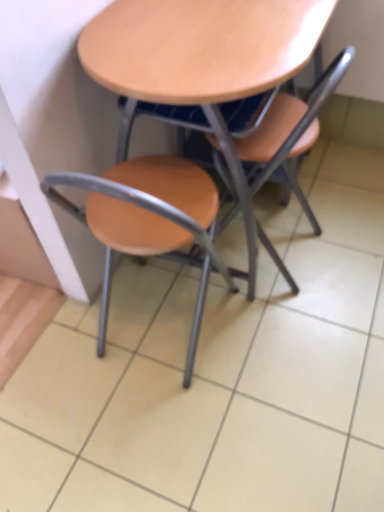
Question: From the image's perspective, is matte wood chair at center, the 1th chair when ordered from left to right, on top of wooden at center?

Choices:
 (A) no
 (B) yes

Answer: (A)

Question: Is matte wood chair at center, marked as the 2th chair in a right-to-left arrangement, wider than wooden at center?

Choices:
 (A) yes
 (B) no

Answer: (B)

Question: Is matte wood chair at center, the 1th chair when ordered from left to right, touching wooden at center?

Choices:
 (A) yes
 (B) no

Answer: (B)

Question: From the image's perspective, is matte wood chair at center, marked as the 2th chair in a right-to-left arrangement, beneath wooden at center?

Choices:
 (A) no
 (B) yes

Answer: (B)

Question: Does matte wood chair at center, marked as the 2th chair in a right-to-left arrangement, lie in front of wooden at center?

Choices:
 (A) yes
 (B) no

Answer: (A)

Question: Considering the positions of matte wood chair at center, which is the second chair in left-to-right order, and matte wood chair at center, marked as the 2th chair in a right-to-left arrangement, in the image, is matte wood chair at center, which is the second chair in left-to-right order, wider or thinner than matte wood chair at center, marked as the 2th chair in a right-to-left arrangement,?

Choices:
 (A) thin
 (B) wide

Answer: (A)

Question: Visually, is matte wood chair at center, acting as the first chair starting from the right, positioned to the left or to the right of matte wood chair at center, marked as the 2th chair in a right-to-left arrangement?

Choices:
 (A) left
 (B) right

Answer: (B)

Question: From the image's perspective, is matte wood chair at center, which is the second chair in left-to-right order, positioned above or below matte wood chair at center, marked as the 2th chair in a right-to-left arrangement?

Choices:
 (A) above
 (B) below

Answer: (A)

Question: Is point (266, 161) positioned closer to the camera than point (193, 198)?

Choices:
 (A) farther
 (B) closer

Answer: (A)

Question: Choose the correct answer: Is wooden at center inside matte wood chair at center, which is the second chair in left-to-right order, or outside it?

Choices:
 (A) inside
 (B) outside

Answer: (B)

Question: Is wooden at center in front of or behind matte wood chair at center, which is the second chair in left-to-right order, in the image?

Choices:
 (A) behind
 (B) front

Answer: (B)

Question: Looking at their shapes, would you say wooden at center is wider or thinner than matte wood chair at center, which is the second chair in left-to-right order?

Choices:
 (A) thin
 (B) wide

Answer: (B)

Question: From a real-world perspective, is wooden at center above or below matte wood chair at center, acting as the first chair starting from the right?

Choices:
 (A) below
 (B) above

Answer: (B)

Question: From a real-world perspective, is matte wood chair at center, acting as the first chair starting from the right, positioned above or below wooden at center?

Choices:
 (A) below
 (B) above

Answer: (A)

Question: Is matte wood chair at center, acting as the first chair starting from the right, in front of or behind wooden at center in the image?

Choices:
 (A) behind
 (B) front

Answer: (A)